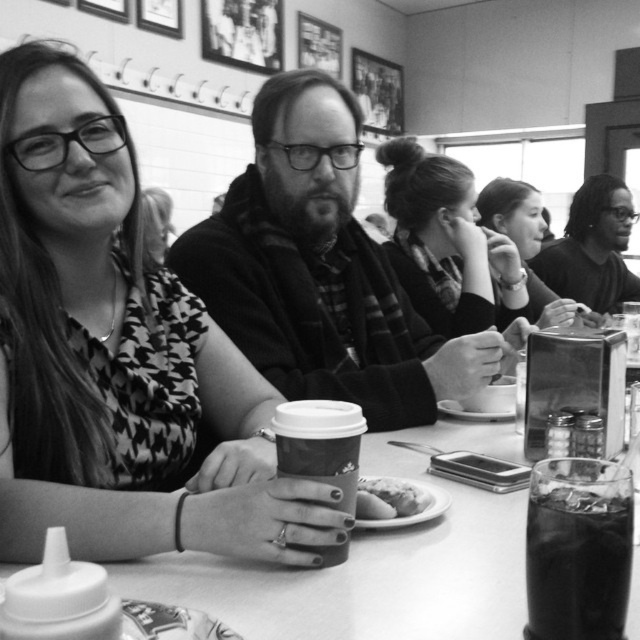
Question: Does dark glass at lower right appear under matte black hair at upper right?

Choices:
 (A) no
 (B) yes

Answer: (B)

Question: Is matte paper cup at center smaller than white bread at center?

Choices:
 (A) no
 (B) yes

Answer: (A)

Question: Which point appears farthest from the camera in this image?

Choices:
 (A) coord(413,490)
 (B) coord(307,636)
 (C) coord(435,305)

Answer: (C)

Question: Does smooth black hair at right appear over matte black hair at upper right?

Choices:
 (A) no
 (B) yes

Answer: (B)

Question: Estimate the real-world distances between objects in this image. Which object is farther from the smooth plastic cup at center?

Choices:
 (A) matte black hoodie at center
 (B) matte black hair at upper right

Answer: (B)

Question: Which object appears closest to the camera in this image?

Choices:
 (A) matte black hoodie at center
 (B) dark glass at lower right

Answer: (B)